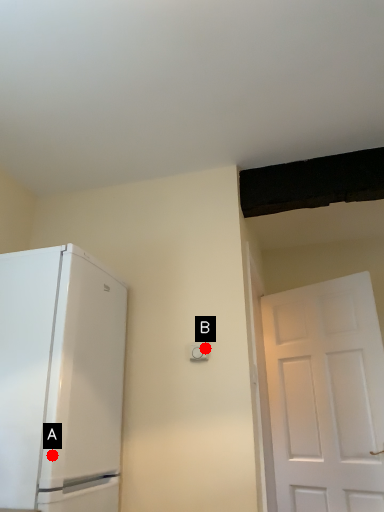
Question: Two points are circled on the image, labeled by A and B beside each circle. Which of the following is the closest to the observer?

Choices:
 (A) A is closer
 (B) B is closer

Answer: (A)